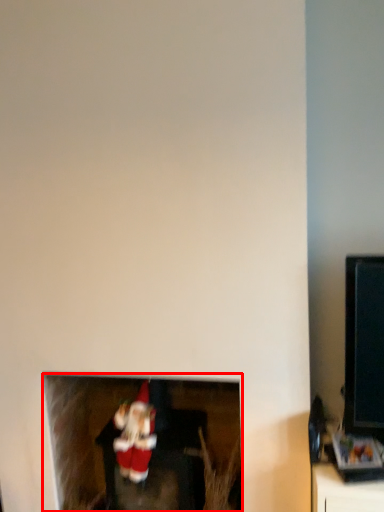
Question: Considering the relative positions of fireplace (annotated by the red box) and santa claus in the image provided, where is fireplace (annotated by the red box) located with respect to the staircase?

Choices:
 (A) right
 (B) left

Answer: (A)